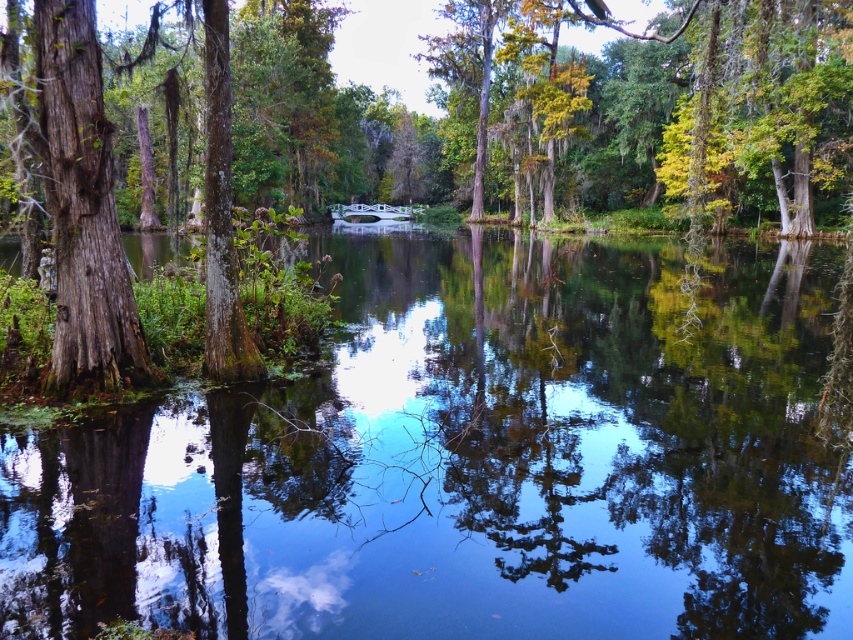
Question: Does clear water at center have a smaller size compared to smooth bark tree at left?

Choices:
 (A) yes
 (B) no

Answer: (B)

Question: Which point is closer to the camera taking this photo?

Choices:
 (A) (337, 214)
 (B) (409, 529)
 (C) (57, 100)

Answer: (B)

Question: In this image, where is clear water at center located relative to smooth bark tree at center?

Choices:
 (A) above
 (B) below

Answer: (B)

Question: Which point is closer to the camera taking this photo?

Choices:
 (A) (90, 259)
 (B) (483, 45)
 (C) (3, 532)
 (D) (347, 218)

Answer: (C)

Question: Which point appears farthest from the camera in this image?

Choices:
 (A) (776, 168)
 (B) (346, 221)
 (C) (62, 152)
 (D) (648, 387)

Answer: (B)

Question: Is clear water at center closer to camera compared to smooth bark tree at center?

Choices:
 (A) no
 (B) yes

Answer: (B)